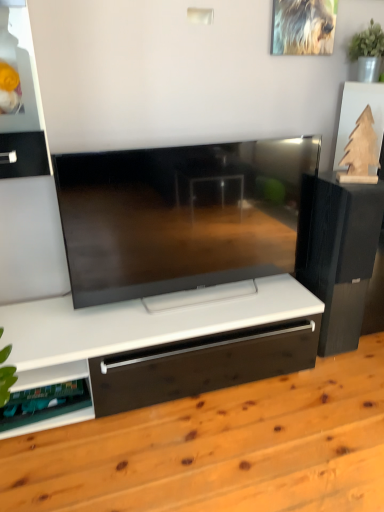
Question: Based on their sizes in the image, would you say green plastic shelf at lower left is bigger or smaller than wooden floor at center?

Choices:
 (A) big
 (B) small

Answer: (B)

Question: In the image, is green plastic shelf at lower left on the left side or the right side of wooden floor at center?

Choices:
 (A) right
 (B) left

Answer: (B)

Question: Which object is positioned farthest from the black matte speaker at right?

Choices:
 (A) wooden floor at center
 (B) green plastic shelf at lower left

Answer: (B)

Question: Estimate the real-world distances between objects in this image. Which object is closer to the black matte speaker at right?

Choices:
 (A) wooden floor at center
 (B) green plastic shelf at lower left

Answer: (A)